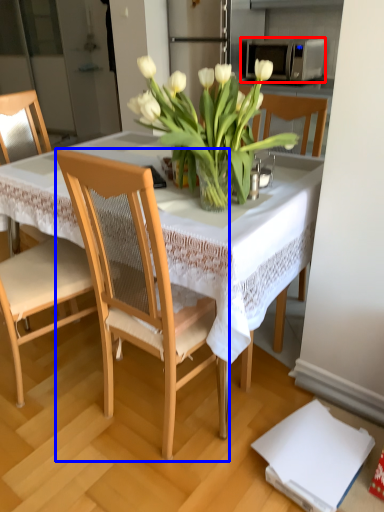
Question: Which object appears closest to the camera in this image, microwave oven (highlighted by a red box) or chair (highlighted by a blue box)?

Choices:
 (A) microwave oven
 (B) chair

Answer: (B)